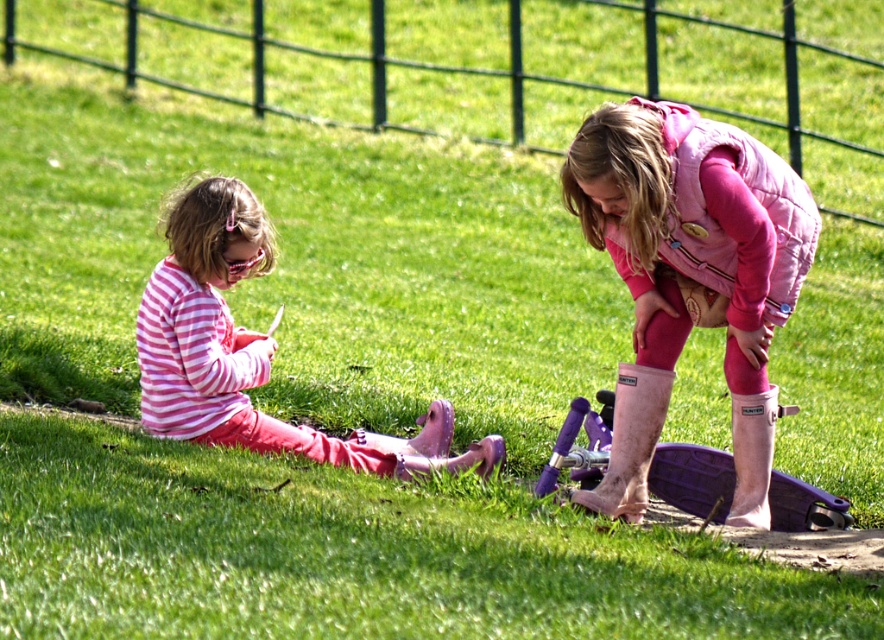
Is pink rubber boots at lower right below pink striped shirt at left?

No, pink rubber boots at lower right is not below pink striped shirt at left.

Which is below, pink rubber boots at lower right or pink striped shirt at left?

pink striped shirt at left is below.

Does point (661, 168) lie in front of point (227, 332)?

That is True.

This screenshot has height=640, width=884. I want to click on pink rubber boots at lower right, so click(690, 275).